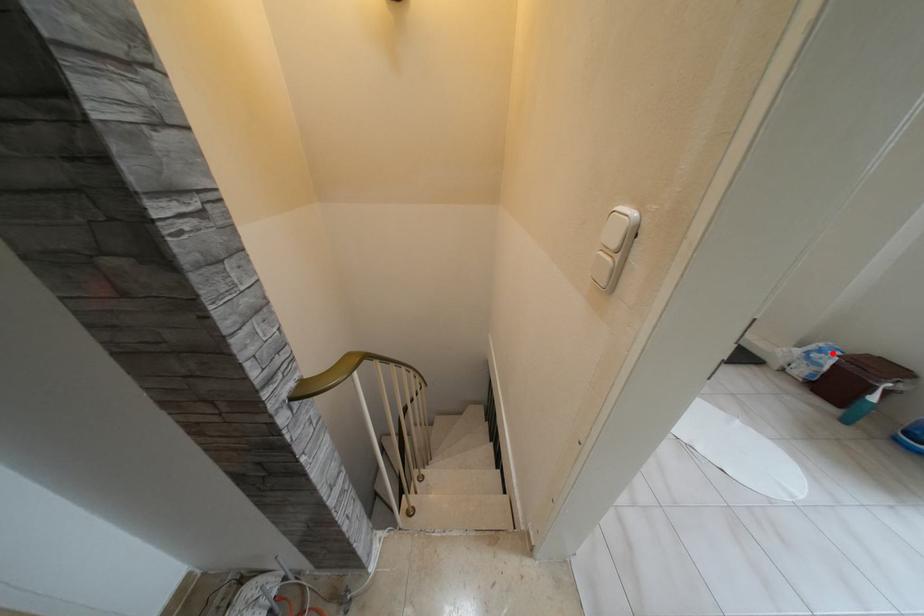
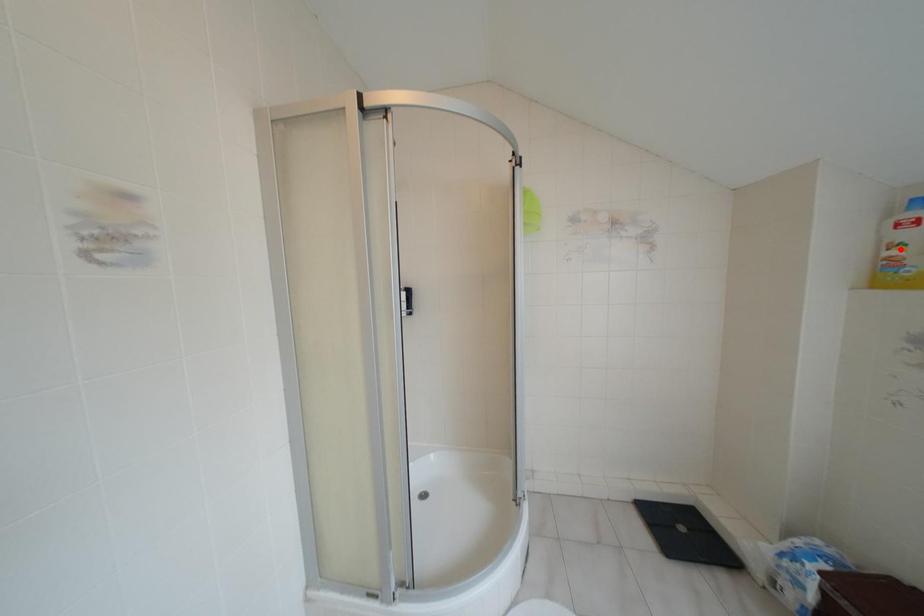
I am providing you with two images of the same scene from different viewpoints. A red point is marked on the first image and another point is marked on the second image. Do the highlighted points in image1 and image2 indicate the same real-world spot?

No